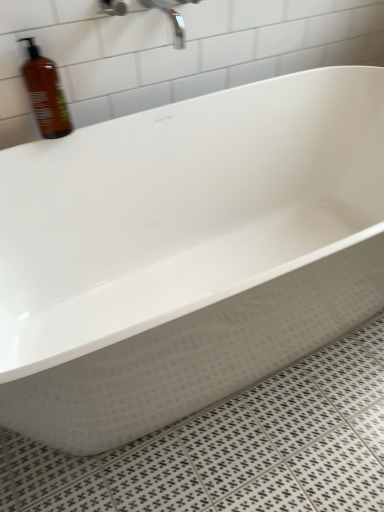
Where is `polished chrome faucet at upper center`? polished chrome faucet at upper center is located at coordinates (169, 18).

What do you see at coordinates (169, 18) in the screenshot?
I see `polished chrome faucet at upper center` at bounding box center [169, 18].

The image size is (384, 512). Describe the element at coordinates (45, 93) in the screenshot. I see `brown matte bottle at upper left` at that location.

What is the approximate width of brown matte bottle at upper left?

brown matte bottle at upper left is 12.00 centimeters wide.

Locate an element on the screen. brown matte bottle at upper left is located at coordinates (45, 93).

I want to click on polished chrome faucet at upper center, so click(x=169, y=18).

Between brown matte bottle at upper left and polished chrome faucet at upper center, which one appears on the left side from the viewer's perspective?

Positioned to the left is brown matte bottle at upper left.

Who is more distant, brown matte bottle at upper left or polished chrome faucet at upper center?

Positioned behind is polished chrome faucet at upper center.

Considering the positions of points (31, 38) and (184, 2), is point (31, 38) closer to camera compared to point (184, 2)?

Yes, point (31, 38) is in front of point (184, 2).

From the image's perspective, is brown matte bottle at upper left located above or below polished chrome faucet at upper center?

brown matte bottle at upper left is below polished chrome faucet at upper center.

From a real-world perspective, which is physically above, brown matte bottle at upper left or polished chrome faucet at upper center?

In real-world perspective, polished chrome faucet at upper center is above.

In terms of width, does brown matte bottle at upper left look wider or thinner when compared to polished chrome faucet at upper center?

brown matte bottle at upper left is thinner than polished chrome faucet at upper center.

Does brown matte bottle at upper left have a greater height compared to polished chrome faucet at upper center?

Yes.

Between brown matte bottle at upper left and polished chrome faucet at upper center, which one has larger size?

Bigger between the two is brown matte bottle at upper left.

Is brown matte bottle at upper left surrounding polished chrome faucet at upper center?

No.

Is brown matte bottle at upper left not close to polished chrome faucet at upper center?

No.

Is brown matte bottle at upper left oriented away from polished chrome faucet at upper center?

brown matte bottle at upper left is not turned away from polished chrome faucet at upper center.

How many degrees apart are the facing directions of brown matte bottle at upper left and polished chrome faucet at upper center?

The angular difference between brown matte bottle at upper left and polished chrome faucet at upper center is 0.00133 degrees.

Measure the distance between brown matte bottle at upper left and polished chrome faucet at upper center.

brown matte bottle at upper left is 13.64 inches away from polished chrome faucet at upper center.

You are a GUI agent. You are given a task and a screenshot of the screen. Output one action in this format:
    pyautogui.click(x=<x>, y=<y>)
    Task: Click on the bottle in front of the polished chrome faucet at upper center
    
    Given the screenshot: What is the action you would take?
    pyautogui.click(x=45, y=93)

Which is more to the left, polished chrome faucet at upper center or brown matte bottle at upper left?

Positioned to the left is brown matte bottle at upper left.

Which object is more forward, polished chrome faucet at upper center or brown matte bottle at upper left?

brown matte bottle at upper left is closer to the camera.

Which is farther, [165,6] or [54,65]?

The point [165,6] is farther.

From the image's perspective, which is above, polished chrome faucet at upper center or brown matte bottle at upper left?

polished chrome faucet at upper center appears higher in the image.

From a real-world perspective, which is physically below, polished chrome faucet at upper center or brown matte bottle at upper left?

In real-world perspective, brown matte bottle at upper left is lower.

Which object is wider, polished chrome faucet at upper center or brown matte bottle at upper left?

polished chrome faucet at upper center.

Can you confirm if polished chrome faucet at upper center is taller than brown matte bottle at upper left?

Incorrect, the height of polished chrome faucet at upper center is not larger of that of brown matte bottle at upper left.

Is polished chrome faucet at upper center bigger than brown matte bottle at upper left?

No.

Is polished chrome faucet at upper center inside the boundaries of brown matte bottle at upper left, or outside?

polished chrome faucet at upper center cannot be found inside brown matte bottle at upper left.

Is there a large distance between polished chrome faucet at upper center and brown matte bottle at upper left?

polished chrome faucet at upper center is actually quite close to brown matte bottle at upper left.

Is polished chrome faucet at upper center oriented away from brown matte bottle at upper left?

polished chrome faucet at upper center does not have its back to brown matte bottle at upper left.

Looking at this image, what's the angular difference between polished chrome faucet at upper center and brown matte bottle at upper left's facing directions?

The facing directions of polished chrome faucet at upper center and brown matte bottle at upper left are 0.00133 degrees apart.

This screenshot has width=384, height=512. I want to click on faucet above the brown matte bottle at upper left (from the image's perspective), so click(169, 18).

Image resolution: width=384 pixels, height=512 pixels. Identify the location of faucet that is on the right side of brown matte bottle at upper left. tap(169, 18).

The height and width of the screenshot is (512, 384). Find the location of `bottle on the left of polished chrome faucet at upper center`. bottle on the left of polished chrome faucet at upper center is located at coordinates (45, 93).